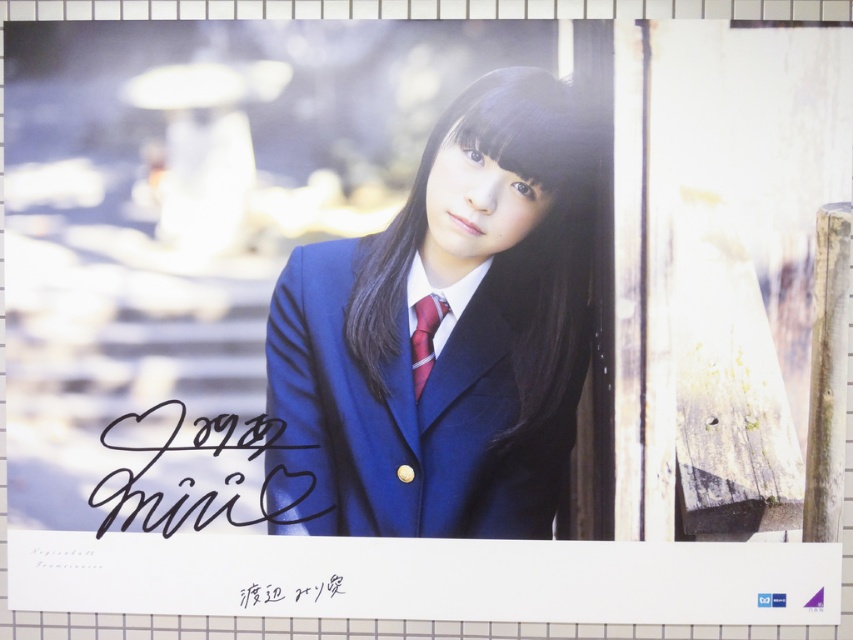
Which of these two, black ink signature at center or shiny red tie at center, stands shorter?

shiny red tie at center

Where is `black ink signature at center`? black ink signature at center is located at coordinates (204, 492).

Does matte blue blazer at center have a lesser width compared to shiny red tie at center?

In fact, matte blue blazer at center might be wider than shiny red tie at center.

Image resolution: width=853 pixels, height=640 pixels. What do you see at coordinates (445, 332) in the screenshot? I see `matte blue blazer at center` at bounding box center [445, 332].

Does point (345, 321) come behind point (434, 296)?

No.

The image size is (853, 640). Find the location of `matte blue blazer at center`. matte blue blazer at center is located at coordinates tap(445, 332).

Can you confirm if shiny red tie at center is wider than black ink signature at lower center?

No.

Who is positioned more to the left, shiny red tie at center or black ink signature at lower center?

From the viewer's perspective, black ink signature at lower center appears more on the left side.

Is point (430, 305) positioned after point (337, 595)?

No, (430, 305) is in front of (337, 595).

Image resolution: width=853 pixels, height=640 pixels. Find the location of `shiny red tie at center`. shiny red tie at center is located at coordinates (425, 337).